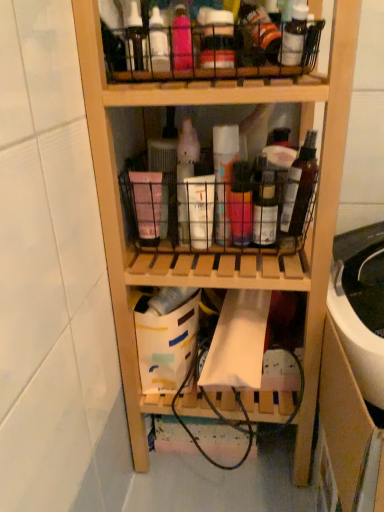
What do you see at coordinates (185, 176) in the screenshot? I see `translucent plastic spray can at center, acting as the fourth bottle starting from the right` at bounding box center [185, 176].

This screenshot has width=384, height=512. Identify the location of wooden shelf at center, placed as the 1th shelf when sorted from bottom to top. (309, 228).

You are a GUI agent. You are given a task and a screenshot of the screen. Output one action in this format:
    pyautogui.click(x=<x>, y=<y>)
    Task: Click on the white matte spray can at center, acting as the second bottle starting from the left
    This screenshot has height=512, width=384.
    Given the screenshot: What is the action you would take?
    (x=224, y=177)

I want to click on metallic wire basket at upper center, the first shelf in the top-to-bottom sequence, so click(x=203, y=46).

Locate an element on the screen. pink matte basket at center is located at coordinates (218, 213).

Describe the element at coordinates (265, 211) in the screenshot. This screenshot has width=384, height=512. I see `translucent plastic bottle at center, the first bottle viewed from the right` at that location.

The image size is (384, 512). In order to click on translucent plastic spray can at center, which is the first bottle in left-to-right order in this screenshot , I will do `click(185, 176)`.

Considering the positions of objects white matte spray can at center, acting as the second bottle starting from the left, and metallic wire basket at upper center, marked as the 2th shelf in a bottom-to-top arrangement, in the image provided, who is more to the left, white matte spray can at center, acting as the second bottle starting from the left, or metallic wire basket at upper center, marked as the 2th shelf in a bottom-to-top arrangement,?

From the viewer's perspective, metallic wire basket at upper center, marked as the 2th shelf in a bottom-to-top arrangement, appears more on the left side.

In the scene shown: Which point is more forward, (x=227, y=155) or (x=162, y=62)?

Positioned in front is point (x=162, y=62).

From a real-world perspective, is white matte spray can at center, acting as the second bottle starting from the left, physically located above or below metallic wire basket at upper center, marked as the 2th shelf in a bottom-to-top arrangement?

In terms of real-world spatial position, white matte spray can at center, acting as the second bottle starting from the left, is below metallic wire basket at upper center, marked as the 2th shelf in a bottom-to-top arrangement.

Based on the photo, is translucent plastic spray can at center, which is the first bottle in left-to-right order, placed right next to translucent plastic bottle at center, the 4th bottle when ordered from left to right?

No, translucent plastic spray can at center, which is the first bottle in left-to-right order, is not beside translucent plastic bottle at center, the 4th bottle when ordered from left to right.

Consider the image. Is the position of translucent plastic spray can at center, acting as the fourth bottle starting from the right, more distant than that of translucent plastic bottle at center, the 4th bottle when ordered from left to right?

Yes, translucent plastic spray can at center, acting as the fourth bottle starting from the right, is further from the viewer.

Looking at this image, from a real-world perspective, which object stands above the other?

translucent plastic spray can at center, acting as the fourth bottle starting from the right, is physically above.

Based on the photo, which of these two, translucent plastic spray can at center, which is the first bottle in left-to-right order, or translucent plastic bottle at center, the first bottle viewed from the right, stands taller?

translucent plastic spray can at center, which is the first bottle in left-to-right order, is taller.

Can you tell me how much wooden shelf at center, which ranks as the second shelf in top-to-bottom order, and pink matte spray can at center, placed as the 3th bottle when sorted from left to right, differ in facing direction?

wooden shelf at center, which ranks as the second shelf in top-to-bottom order, and pink matte spray can at center, placed as the 3th bottle when sorted from left to right, are facing 4.48 degrees away from each other.

Which object is positioned more to the right, wooden shelf at center, which ranks as the second shelf in top-to-bottom order, or pink matte spray can at center, which ranks as the second bottle in right-to-left order?

pink matte spray can at center, which ranks as the second bottle in right-to-left order, is more to the right.

Who is smaller, wooden shelf at center, placed as the 1th shelf when sorted from bottom to top, or pink matte spray can at center, placed as the 3th bottle when sorted from left to right?

Smaller between the two is pink matte spray can at center, placed as the 3th bottle when sorted from left to right.

Is pink matte spray can at center, which ranks as the second bottle in right-to-left order, inside wooden shelf at center, which ranks as the second shelf in top-to-bottom order?

Yes, pink matte spray can at center, which ranks as the second bottle in right-to-left order, can be found within wooden shelf at center, which ranks as the second shelf in top-to-bottom order.

In the scene shown: How far apart are pink matte spray can at center, which ranks as the second bottle in right-to-left order, and pink matte basket at center?

A distance of 2.75 inches exists between pink matte spray can at center, which ranks as the second bottle in right-to-left order, and pink matte basket at center.

Which of these two, pink matte spray can at center, placed as the 3th bottle when sorted from left to right, or pink matte basket at center, is bigger?

pink matte basket at center.

Starting from the pink matte basket at center, which bottle is the 2nd one in front? Please provide its 2D coordinates.

[(241, 204)]

Which is in front, point (187, 140) or point (158, 100)?

Positioned in front is point (158, 100).

Is translucent plastic spray can at center, acting as the fourth bottle starting from the right, looking in the opposite direction of wooden shelf at center, placed as the 1th shelf when sorted from bottom to top?

Yes.

Locate an element on the screen. the 4th bottle behind the wooden shelf at center, placed as the 1th shelf when sorted from bottom to top, starting your count from the anchor is located at coordinates tap(185, 176).

What's the angular difference between translucent plastic spray can at center, which is the first bottle in left-to-right order, and wooden shelf at center, which ranks as the second shelf in top-to-bottom order,'s facing directions?

The angle between the facing direction of translucent plastic spray can at center, which is the first bottle in left-to-right order, and the facing direction of wooden shelf at center, which ranks as the second shelf in top-to-bottom order, is 2.17 degrees.

How far apart are wooden drawer at lower right and pink matte spray can at center, placed as the 3th bottle when sorted from left to right?

wooden drawer at lower right and pink matte spray can at center, placed as the 3th bottle when sorted from left to right, are 11.99 inches apart from each other.

Is point (326, 422) behind point (233, 239)?

No, (326, 422) is closer to viewer.

How different are the orientations of wooden drawer at lower right and pink matte spray can at center, placed as the 3th bottle when sorted from left to right, in degrees?

The facing directions of wooden drawer at lower right and pink matte spray can at center, placed as the 3th bottle when sorted from left to right, are 2.44 degrees apart.

Which object is further away from the camera taking this photo, wooden drawer at lower right or pink matte spray can at center, which ranks as the second bottle in right-to-left order?

Positioned behind is pink matte spray can at center, which ranks as the second bottle in right-to-left order.

Considering the relative sizes of metallic wire basket at upper center, the first shelf in the top-to-bottom sequence, and pink matte basket at center in the image provided, is metallic wire basket at upper center, the first shelf in the top-to-bottom sequence, shorter than pink matte basket at center?

Yes, metallic wire basket at upper center, the first shelf in the top-to-bottom sequence, is shorter than pink matte basket at center.

From the picture: From the image's perspective, is metallic wire basket at upper center, the first shelf in the top-to-bottom sequence, above pink matte basket at center?

Yes, from the image's perspective, metallic wire basket at upper center, the first shelf in the top-to-bottom sequence, is on top of pink matte basket at center.

Is metallic wire basket at upper center, the first shelf in the top-to-bottom sequence, oriented towards pink matte basket at center?

No, metallic wire basket at upper center, the first shelf in the top-to-bottom sequence, is not aimed at pink matte basket at center.

From a real-world perspective, does metallic wire basket at upper center, the first shelf in the top-to-bottom sequence, sit lower than pink matte basket at center?

Incorrect, from a real-world perspective, metallic wire basket at upper center, the first shelf in the top-to-bottom sequence, is higher than pink matte basket at center.

Starting from the metallic wire basket at upper center, the first shelf in the top-to-bottom sequence, which bottle is the 1st one to the right? Please provide its 2D coordinates.

[(224, 177)]

Find the location of a particular element. This screenshot has height=512, width=384. the 2nd bottle below the translucent plastic spray can at center, which is the first bottle in left-to-right order (from the image's perspective) is located at coordinates (265, 211).

From the image, which object appears to be farther from pink matte basket at center, wooden drawer at lower right or white matte spray can at center, arranged as the 3th bottle when viewed from the right?

wooden drawer at lower right.

Based on their spatial positions, is pink matte spray can at center, which ranks as the second bottle in right-to-left order, or translucent plastic bottle at center, the 4th bottle when ordered from left to right, closer to translucent plastic spray can at center, which is the first bottle in left-to-right order?

Among the two, pink matte spray can at center, which ranks as the second bottle in right-to-left order, is located nearer to translucent plastic spray can at center, which is the first bottle in left-to-right order.

Estimate the real-world distances between objects in this image. Which object is further from white matte spray can at center, acting as the second bottle starting from the left, pink matte spray can at center, which ranks as the second bottle in right-to-left order, or translucent plastic bottle at center, the first bottle viewed from the right?

Based on the image, translucent plastic bottle at center, the first bottle viewed from the right, appears to be further to white matte spray can at center, acting as the second bottle starting from the left.

Based on their spatial positions, is translucent plastic spray can at center, which is the first bottle in left-to-right order, or translucent plastic bottle at center, the first bottle viewed from the right, further from metallic wire basket at upper center, the first shelf in the top-to-bottom sequence?

Among the two, translucent plastic bottle at center, the first bottle viewed from the right, is located further to metallic wire basket at upper center, the first shelf in the top-to-bottom sequence.

Estimate the real-world distances between objects in this image. Which object is further from white matte spray can at center, arranged as the 3th bottle when viewed from the right, translucent plastic bottle at center, the first bottle viewed from the right, or wooden shelf at center, placed as the 1th shelf when sorted from bottom to top?

wooden shelf at center, placed as the 1th shelf when sorted from bottom to top, is positioned further to the anchor white matte spray can at center, arranged as the 3th bottle when viewed from the right.

Which object lies further to the anchor point translucent plastic spray can at center, which is the first bottle in left-to-right order, metallic wire basket at upper center, marked as the 2th shelf in a bottom-to-top arrangement, or pink matte basket at center?

Based on the image, metallic wire basket at upper center, marked as the 2th shelf in a bottom-to-top arrangement, appears to be further to translucent plastic spray can at center, which is the first bottle in left-to-right order.

Looking at this image, when comparing their distances from translucent plastic bottle at center, the first bottle viewed from the right, does pink matte spray can at center, which ranks as the second bottle in right-to-left order, or translucent plastic spray can at center, which is the first bottle in left-to-right order, seem closer?

Based on the image, pink matte spray can at center, which ranks as the second bottle in right-to-left order, appears to be nearer to translucent plastic bottle at center, the first bottle viewed from the right.

Looking at the image, which one is located further to white matte spray can at center, acting as the second bottle starting from the left, translucent plastic spray can at center, acting as the fourth bottle starting from the right, or wooden shelf at center, placed as the 1th shelf when sorted from bottom to top?

wooden shelf at center, placed as the 1th shelf when sorted from bottom to top.

Image resolution: width=384 pixels, height=512 pixels. I want to click on shelf that lies between translucent plastic bottle at center, the 4th bottle when ordered from left to right, and wooden drawer at lower right from top to bottom, so click(x=309, y=228).

Locate an element on the screen. The image size is (384, 512). basket between translucent plastic spray can at center, which is the first bottle in left-to-right order, and wooden drawer at lower right from top to bottom is located at coordinates (218, 213).

I want to click on basket between metallic wire basket at upper center, the first shelf in the top-to-bottom sequence, and translucent plastic bottle at center, the first bottle viewed from the right, in the up-down direction, so click(x=218, y=213).

Where is `basket between translucent plastic spray can at center, acting as the fourth bottle starting from the right, and translucent plastic bottle at center, the 4th bottle when ordered from left to right, in the horizontal direction`? basket between translucent plastic spray can at center, acting as the fourth bottle starting from the right, and translucent plastic bottle at center, the 4th bottle when ordered from left to right, in the horizontal direction is located at coordinates (218, 213).